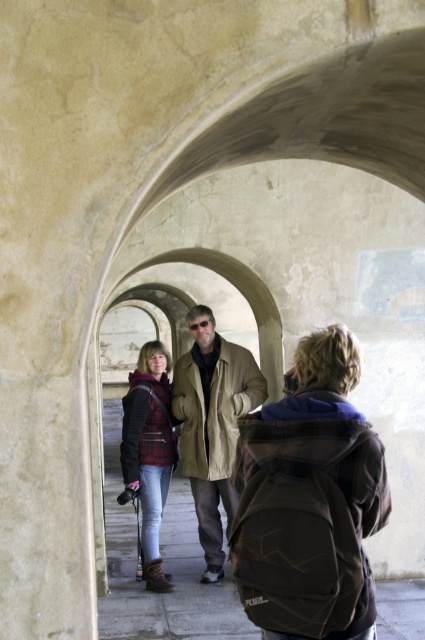
Does brown fabric backpack at center appear on the right side of tan leather jacket at center?

No, brown fabric backpack at center is not to the right of tan leather jacket at center.

Is point (187, 602) closer to viewer compared to point (235, 420)?

Yes, it is.

I want to click on brown fabric backpack at center, so point(172,579).

Where is `brown plaid jacket at center`? This screenshot has height=640, width=425. brown plaid jacket at center is located at coordinates (309, 500).

Does brown plaid jacket at center appear on the left side of tan leather jacket at center?

In fact, brown plaid jacket at center is to the right of tan leather jacket at center.

Find the location of `brown plaid jacket at center`. brown plaid jacket at center is located at coordinates (309, 500).

Can you confirm if brown fabric backpack at center is positioned to the left of plaid fabric jacket at center?

Indeed, brown fabric backpack at center is positioned on the left side of plaid fabric jacket at center.

Who is shorter, brown fabric backpack at center or plaid fabric jacket at center?

With less height is brown fabric backpack at center.

Describe the element at coordinates (172, 579) in the screenshot. I see `brown fabric backpack at center` at that location.

Image resolution: width=425 pixels, height=640 pixels. I want to click on brown fabric backpack at center, so click(x=172, y=579).